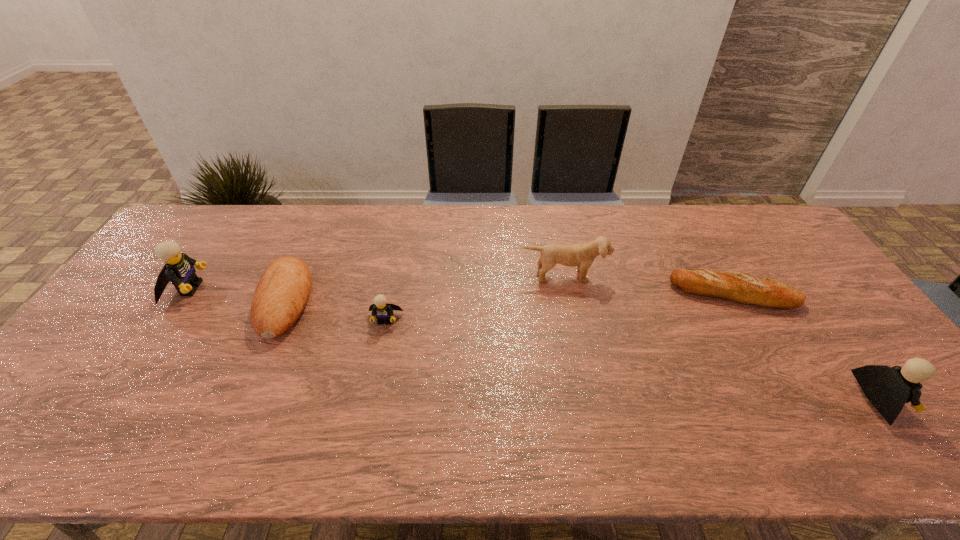
Identify the location of the farthest Lego. (179, 269).

Locate an element on the screen. the leftmost object is located at coordinates (179, 269).

Identify the location of the second nearest Lego. This screenshot has width=960, height=540. (383, 310).

I want to click on the second Lego from right to left, so click(x=383, y=310).

You are a GUI agent. You are given a task and a screenshot of the screen. Output one action in this format:
    pyautogui.click(x=<x>, y=<y>)
    Task: Click on the nearest Lego
    
    Given the screenshot: What is the action you would take?
    pyautogui.click(x=888, y=388)

You are a GUI agent. You are given a task and a screenshot of the screen. Output one action in this format:
    pyautogui.click(x=<x>, y=<y>)
    Task: Click on the second shortest Lego
    Image resolution: width=960 pixels, height=540 pixels.
    Given the screenshot: What is the action you would take?
    pyautogui.click(x=888, y=388)

Identify the location of the shortest object. The height and width of the screenshot is (540, 960). (739, 287).

I want to click on the fourth object from left to right, so click(582, 255).

This screenshot has width=960, height=540. I want to click on the second object from left to right, so click(280, 297).

Locate an element on the screen. Image resolution: width=960 pixels, height=540 pixels. vacant region located 0.330m on the front-facing side of the leftmost object is located at coordinates (316, 288).